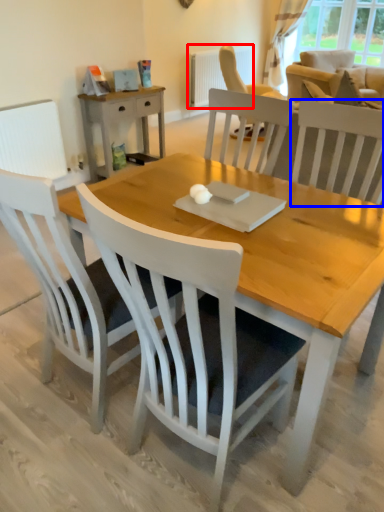
Question: Which object is closer to the camera taking this photo, radiator (highlighted by a red box) or chair (highlighted by a blue box)?

Choices:
 (A) radiator
 (B) chair

Answer: (B)